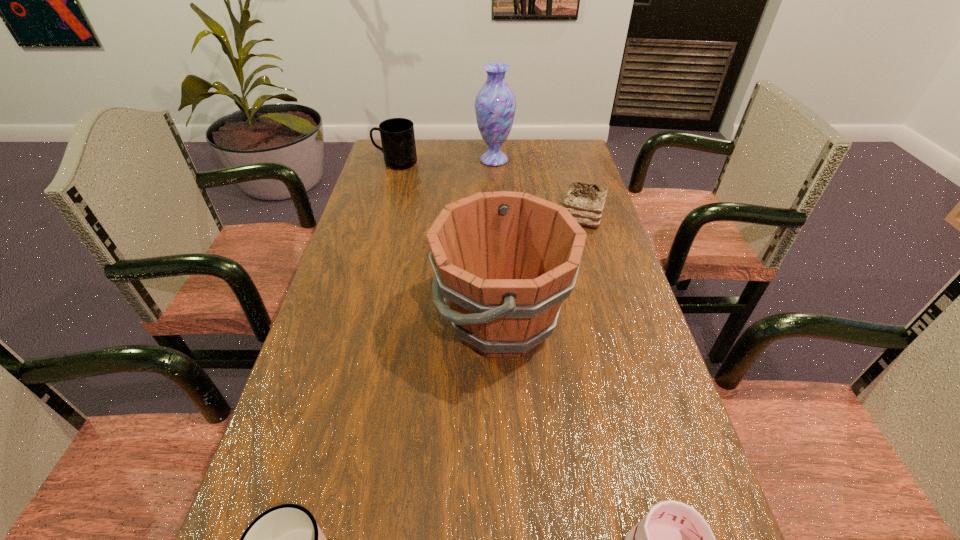
This screenshot has height=540, width=960. I want to click on vase, so click(x=495, y=104).

Where is `bucket`? The image size is (960, 540). bucket is located at coordinates (504, 261).

Where is `the third nearest object`? Image resolution: width=960 pixels, height=540 pixels. the third nearest object is located at coordinates [x=504, y=261].

This screenshot has width=960, height=540. Find the location of `the fourth shortest object`. the fourth shortest object is located at coordinates (397, 135).

The width and height of the screenshot is (960, 540). I want to click on the farthest mug, so click(x=397, y=135).

Locate an element on the screen. The height and width of the screenshot is (540, 960). the fourth nearest object is located at coordinates (585, 202).

Identify the location of vacant space situated on the right of the tallest object. (553, 160).

Find the location of `vacant space located on the handle side of the fourth farthest object`. vacant space located on the handle side of the fourth farthest object is located at coordinates (370, 321).

At what (x,y) coordinates should I click in order to perform the action: click on vacant space located 0.090m on the handle side of the fourth farthest object. Please return your answer as a coordinate pair (x, y). The width and height of the screenshot is (960, 540). Looking at the image, I should click on (396, 321).

This screenshot has width=960, height=540. Find the location of `blank space located 0.210m on the handle side of the fourth farthest object`. blank space located 0.210m on the handle side of the fourth farthest object is located at coordinates (344, 321).